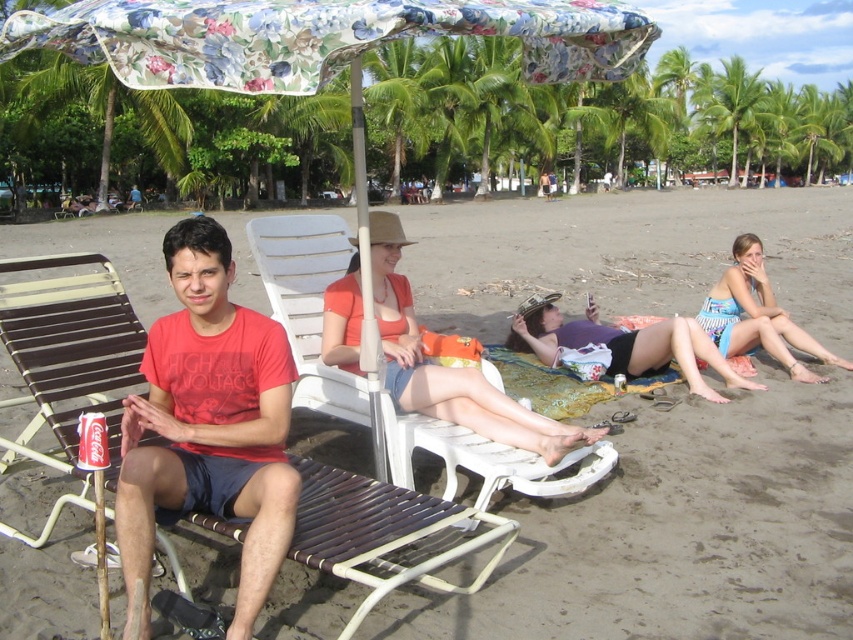
Is floral fabric umbrella at upper center closer to the viewer compared to striped fabric bikini bottom at lower right?

Yes.

I want to click on floral fabric umbrella at upper center, so click(x=325, y=60).

Is point (277, 29) in front of point (740, 280)?

Yes, it is.

Locate an element on the screen. This screenshot has width=853, height=640. floral fabric umbrella at upper center is located at coordinates (325, 60).

Based on the photo, does floral fabric umbrella at upper center have a smaller size compared to brown woven beach chair at left?

Correct, floral fabric umbrella at upper center occupies less space than brown woven beach chair at left.

Is point (358, 184) in front of point (387, 522)?

No, (358, 184) is behind (387, 522).

Identify the location of floral fabric umbrella at upper center. (325, 60).

Is point (312, 3) farther from camera compared to point (746, 116)?

That is False.

Is floral fabric umbrella at upper center taller than green leafy palm tree at upper right?

In fact, floral fabric umbrella at upper center may be shorter than green leafy palm tree at upper right.

Which is in front, point (115, 70) or point (732, 161)?

Point (115, 70) is more forward.

Where is `floral fabric umbrella at upper center`? floral fabric umbrella at upper center is located at coordinates (325, 60).